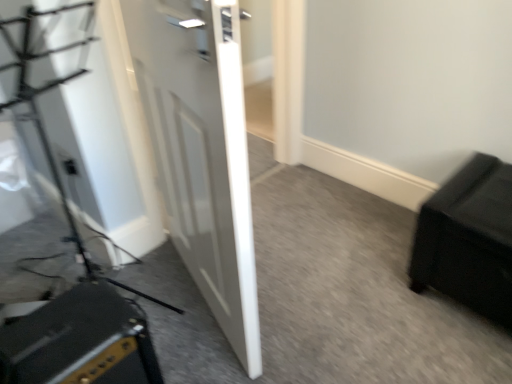
Question: Is white glossy door at center positioned behind black matte speaker at lower left?

Choices:
 (A) yes
 (B) no

Answer: (B)

Question: From a real-world perspective, is white glossy door at center under black matte speaker at lower left?

Choices:
 (A) yes
 (B) no

Answer: (B)

Question: Is white glossy door at center completely or partially outside of black matte speaker at lower left?

Choices:
 (A) yes
 (B) no

Answer: (A)

Question: Is white glossy door at center oriented towards black matte speaker at lower left?

Choices:
 (A) no
 (B) yes

Answer: (B)

Question: Can you confirm if white glossy door at center is bigger than black matte speaker at lower left?

Choices:
 (A) no
 (B) yes

Answer: (B)

Question: Is matte black outlet at lower left wider or thinner than black matte speaker at lower left?

Choices:
 (A) wide
 (B) thin

Answer: (B)

Question: Is matte black outlet at lower left taller or shorter than black matte speaker at lower left?

Choices:
 (A) short
 (B) tall

Answer: (A)

Question: Is point (69, 163) positioned closer to the camera than point (45, 334)?

Choices:
 (A) farther
 (B) closer

Answer: (A)

Question: Considering their positions, is matte black outlet at lower left located in front of or behind black matte speaker at lower left?

Choices:
 (A) front
 (B) behind

Answer: (B)

Question: Looking at their shapes, would you say black matte speaker at lower left is wider or thinner than white glossy door at center?

Choices:
 (A) thin
 (B) wide

Answer: (B)

Question: Do you think black matte speaker at lower left is within white glossy door at center, or outside of it?

Choices:
 (A) outside
 (B) inside

Answer: (A)

Question: Based on their positions, is black matte speaker at lower left located to the left or right of white glossy door at center?

Choices:
 (A) right
 (B) left

Answer: (B)

Question: From a real-world perspective, is black matte speaker at lower left above or below white glossy door at center?

Choices:
 (A) below
 (B) above

Answer: (A)

Question: Considering the positions of point (64, 162) and point (474, 205), is point (64, 162) closer or farther from the camera than point (474, 205)?

Choices:
 (A) closer
 (B) farther

Answer: (B)

Question: Visually, is matte black outlet at lower left positioned to the left or to the right of black leather ottoman at lower right?

Choices:
 (A) right
 (B) left

Answer: (B)